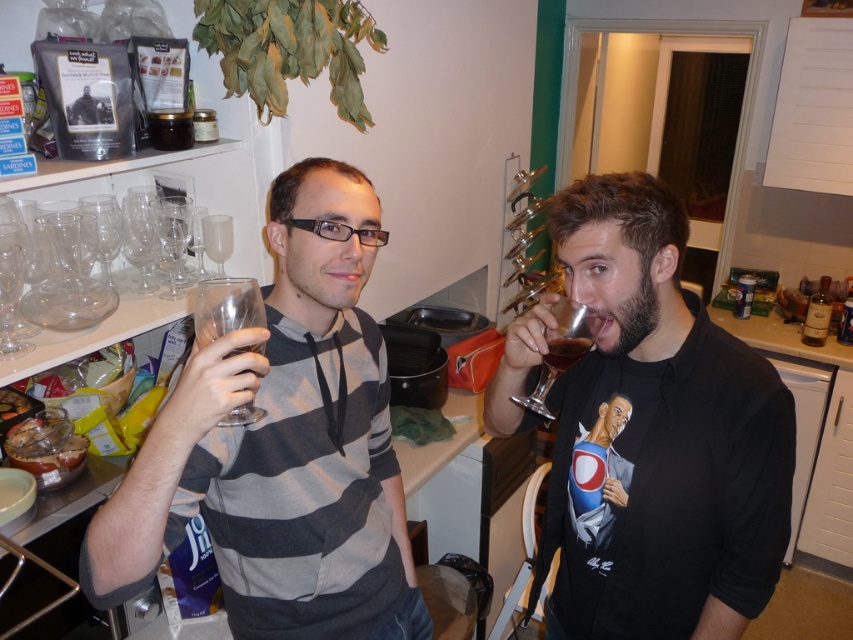
You are standing in the kitchen and want to find the matte black t shirt at center. Based on the coordinates given, which object is located at point (659, 436)?

The point (659, 436) marks the location of the matte black t shirt at center.